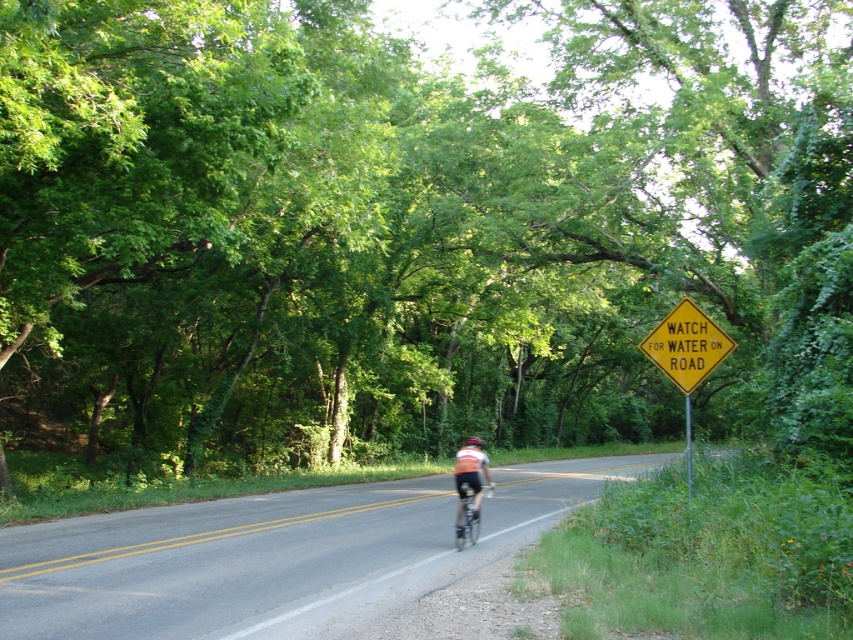
Is orange fabric cyclist at center positioned in front of metallic silver bicycle at center?

No, it is not.

Locate an element on the screen. This screenshot has width=853, height=640. orange fabric cyclist at center is located at coordinates (469, 480).

Which is below, yellow diamond-shaped sign at upper right or orange fabric cyclist at center?

orange fabric cyclist at center is below.

Which is more to the left, yellow diamond-shaped sign at upper right or orange fabric cyclist at center?

Positioned to the left is orange fabric cyclist at center.

Is point (686, 301) positioned after point (463, 522)?

No, (686, 301) is closer to viewer.

Locate an element on the screen. This screenshot has width=853, height=640. yellow diamond-shaped sign at upper right is located at coordinates (686, 346).

Does orange fabric cyclist at center have a greater height compared to black matte bicycle helmet at center?

Yes.

Who is more distant from viewer, (461, 500) or (468, 444)?

Positioned behind is point (468, 444).

Does point (469, 461) come in front of point (476, 436)?

Yes, it is.

You are a GUI agent. You are given a task and a screenshot of the screen. Output one action in this format:
    pyautogui.click(x=<x>, y=<y>)
    Task: Click on the orange fabric cyclist at center
    The image size is (853, 640).
    Given the screenshot: What is the action you would take?
    pyautogui.click(x=469, y=480)